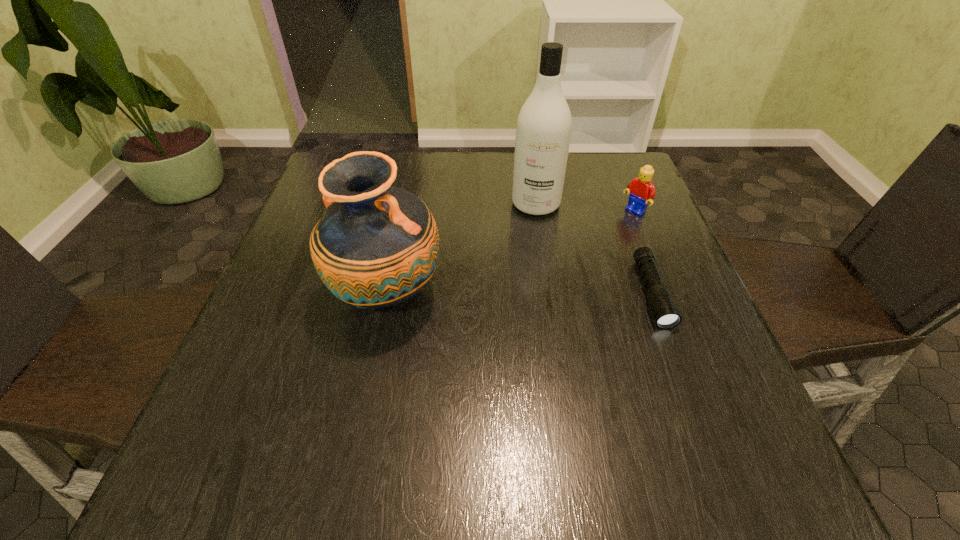
This screenshot has height=540, width=960. I want to click on vacant spot on the desktop that is between the pottery and the flashlight and is positioned on the front-facing side of the Lego, so click(x=525, y=294).

Where is `free space on the desktop that is between the pottery and the shortest object and is positioned on the front-facing side of the second object from left to right`? The width and height of the screenshot is (960, 540). free space on the desktop that is between the pottery and the shortest object and is positioned on the front-facing side of the second object from left to right is located at coordinates (517, 294).